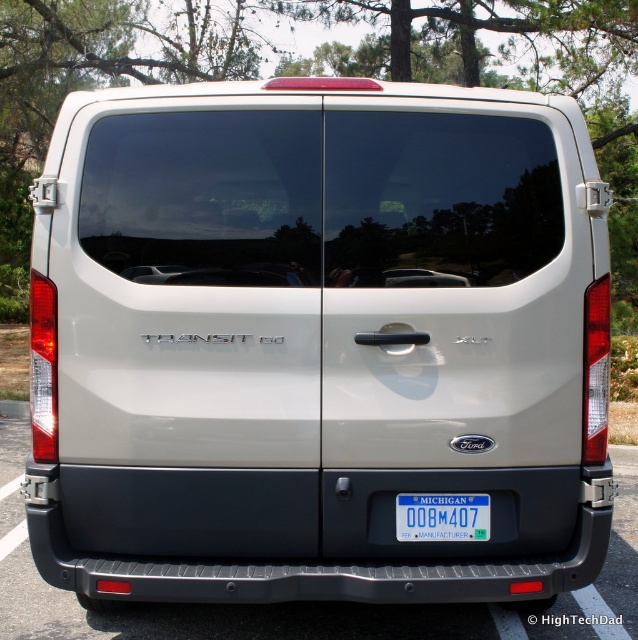
Question: Which point appears farthest from the camera in this image?

Choices:
 (A) (443, 493)
 (B) (477, 636)

Answer: (B)

Question: Is gray rubber bumper at lower center smaller than blue plastic license plate at center?

Choices:
 (A) no
 (B) yes

Answer: (A)

Question: Is gray rubber bumper at lower center below blue plastic license plate at center?

Choices:
 (A) yes
 (B) no

Answer: (A)

Question: Is gray rubber bumper at lower center to the left of blue plastic license plate at center from the viewer's perspective?

Choices:
 (A) yes
 (B) no

Answer: (A)

Question: Among these points, which one is nearest to the camera?

Choices:
 (A) (454, 516)
 (B) (441, 621)

Answer: (A)